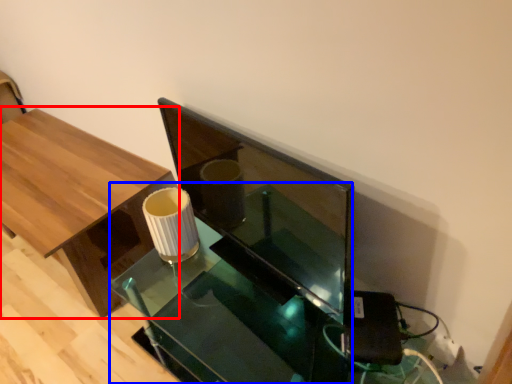
Question: Among these objects, which one is nearest to the camera, table (highlighted by a red box) or round table (highlighted by a blue box)?

Choices:
 (A) table
 (B) round table

Answer: (B)